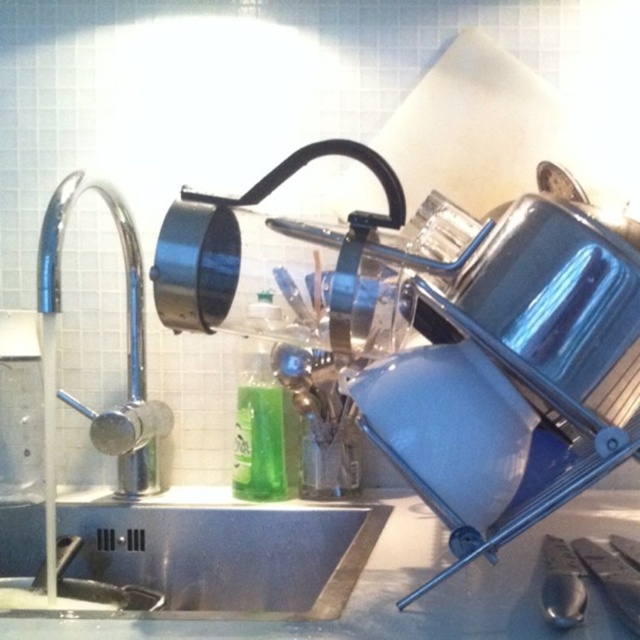
Based on the coordinates provided, which object is located at point (156,508)?

The point (156,508) corresponds to the stainless steel sink at left.

You are organizing the kitchen and need to place a new spice jar between the stainless steel sink at left and the stainless steel sink at lower left. Which sink should you place the spice jar closer to if you want it to be closer to the left side of the kitchen?

You should place the spice jar closer to the stainless steel sink at left because it is positioned on the left side of the stainless steel sink at lower left, making it nearer to the left side of the kitchen.